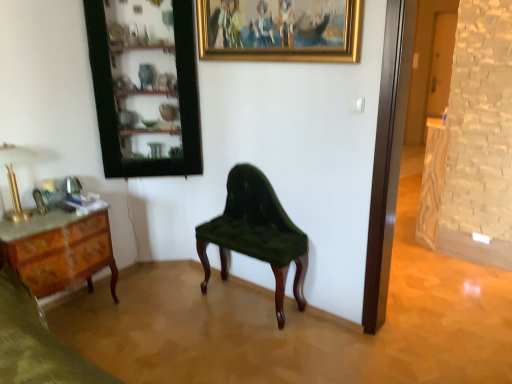
Find the location of a particular element. The height and width of the screenshot is (384, 512). free space that is to the left of velvet green chair at center is located at coordinates (177, 307).